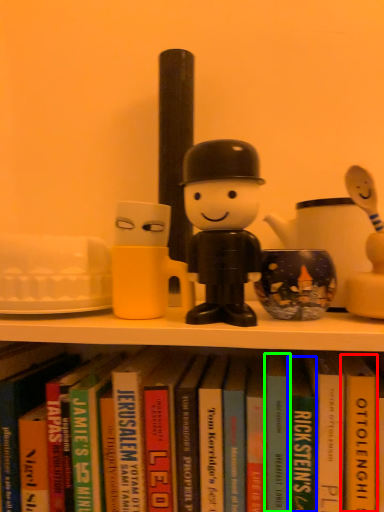
Question: Which object is positioned closest to paperback book (highlighted by a red box)? Select from paperback book (highlighted by a blue box) and paperback book (highlighted by a green box).

Choices:
 (A) paperback book
 (B) paperback book

Answer: (A)